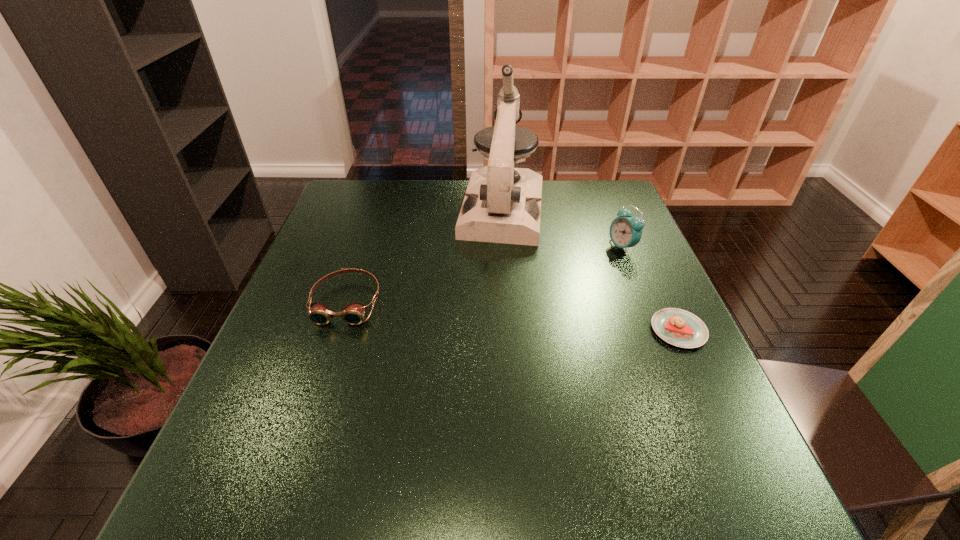
Identify the location of free space located 0.220m at the eyepiece of the microscope. The image size is (960, 540). (489, 301).

Locate an element on the screen. The width and height of the screenshot is (960, 540). vacant space located 0.210m on the face of the third shortest object is located at coordinates (560, 286).

Where is `vacant space located on the face of the third shortest object`? The height and width of the screenshot is (540, 960). vacant space located on the face of the third shortest object is located at coordinates (585, 271).

Where is `free space located on the face of the third shortest object`? The image size is (960, 540). free space located on the face of the third shortest object is located at coordinates (565, 282).

Where is `object positioned at the far edge`? This screenshot has width=960, height=540. object positioned at the far edge is located at coordinates (502, 204).

What are the coordinates of `object located at the left edge` in the screenshot? It's located at (353, 313).

Identify the location of pastry present at the right edge. (678, 327).

The image size is (960, 540). What are the coordinates of `alarm clock situated at the right edge` in the screenshot? It's located at (625, 231).

Identify the location of free point at the far edge. The width and height of the screenshot is (960, 540). (542, 183).

Image resolution: width=960 pixels, height=540 pixels. I want to click on vacant space at the near edge, so click(x=626, y=410).